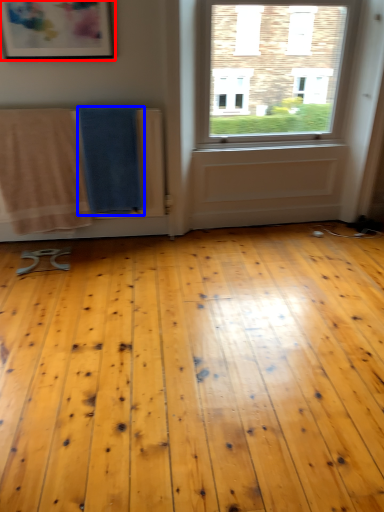
Question: Which point is further to the camera, picture frame (highlighted by a red box) or beach towel (highlighted by a blue box)?

Choices:
 (A) picture frame
 (B) beach towel

Answer: (B)